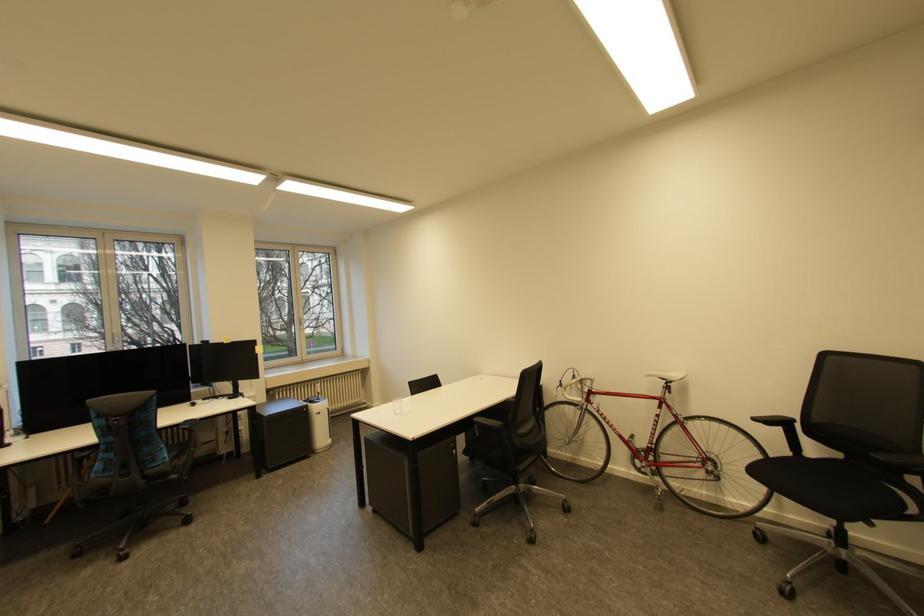
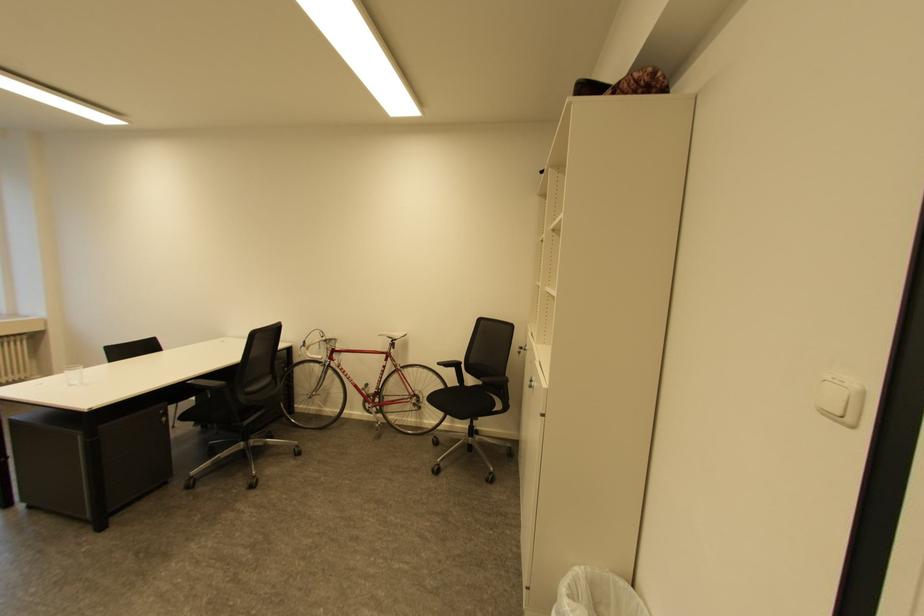
Locate, in the second image, the point that corresponds to (397,403) in the first image.

(70, 371)